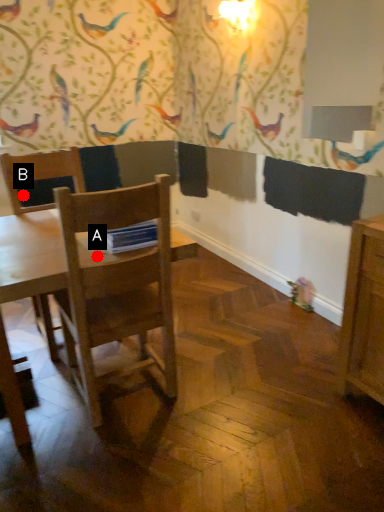
Question: Two points are circled on the image, labeled by A and B beside each circle. Which point is closer to the camera taking this photo?

Choices:
 (A) A is closer
 (B) B is closer

Answer: (A)